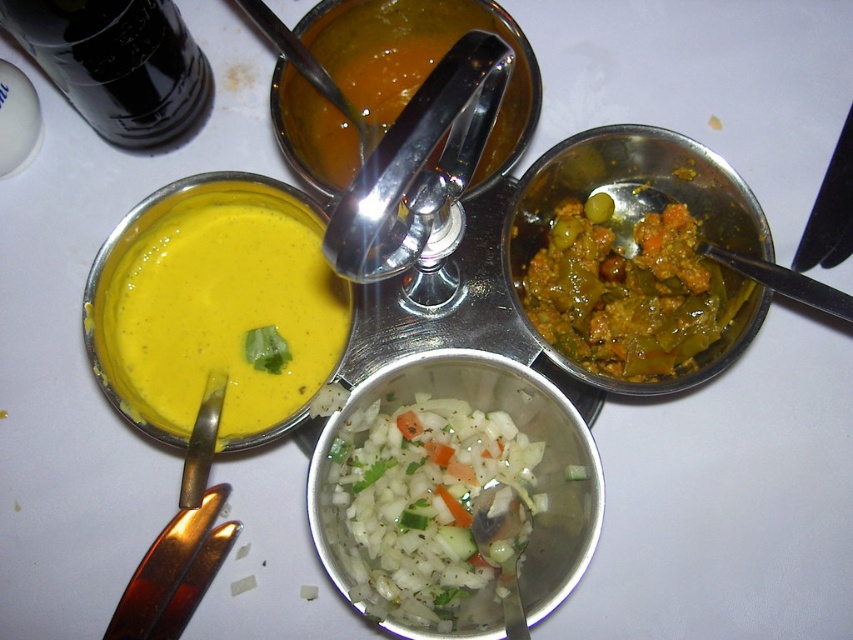
Question: Can you confirm if yellow matte bowl at left is bigger than white translucent chopped vegetables at center?

Choices:
 (A) yes
 (B) no

Answer: (B)

Question: Which of the following is the farthest from the observer?

Choices:
 (A) green matte curry at upper right
 (B) green leafy vegetable at center
 (C) orange smoothie at center
 (D) white translucent chopped vegetables at center

Answer: (C)

Question: Estimate the real-world distances between objects in this image. Which object is closer to the green leafy vegetable at center?

Choices:
 (A) green matte curry at upper right
 (B) green matte vegetable at center

Answer: (A)

Question: Can you confirm if yellow matte bowl at left is positioned below white translucent chopped vegetables at center?

Choices:
 (A) no
 (B) yes

Answer: (A)

Question: Among these objects, which one is nearest to the camera?

Choices:
 (A) white translucent chopped vegetables at center
 (B) green cucumber at center
 (C) green leafy vegetable at center

Answer: (A)

Question: Can you confirm if orange smoothie at center is positioned to the right of green leafy vegetable at center?

Choices:
 (A) yes
 (B) no

Answer: (A)